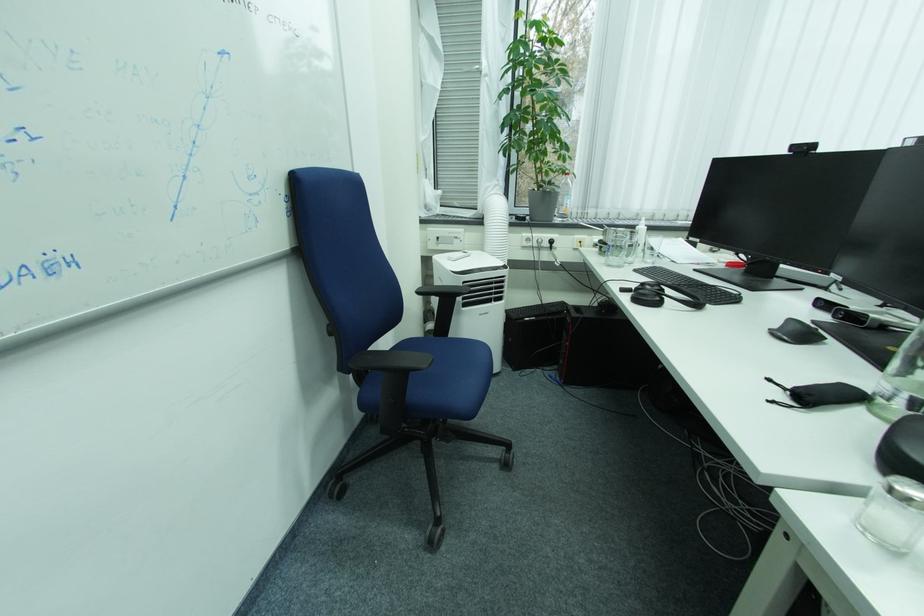
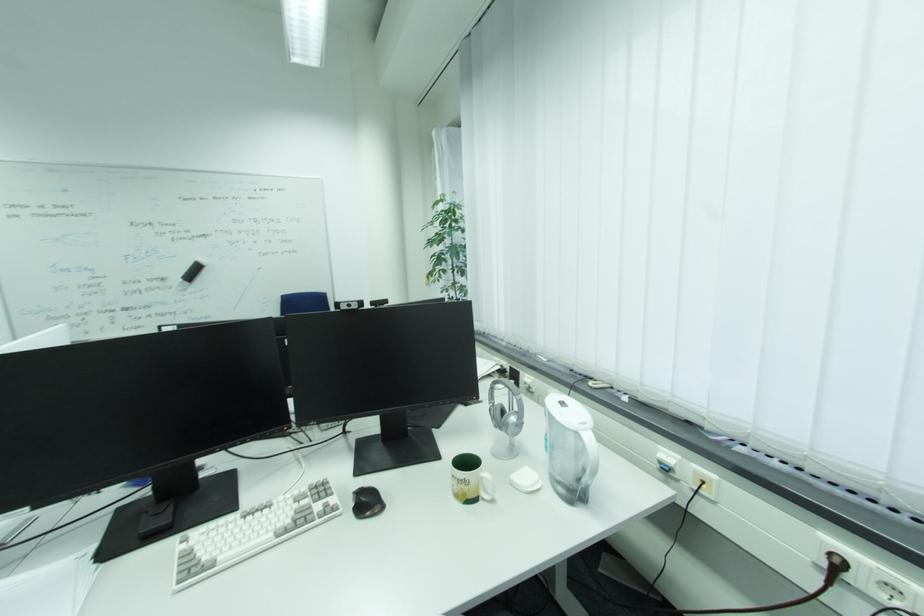
Question: I am providing you with two images of the same scene from different viewpoints. After the viewpoint changes to image2, which objects are now occluded?

Choices:
 (A) black computer mouse
 (B) White hat
 (C) black drawstring pouch
 (D) black webcam

Answer: (C)